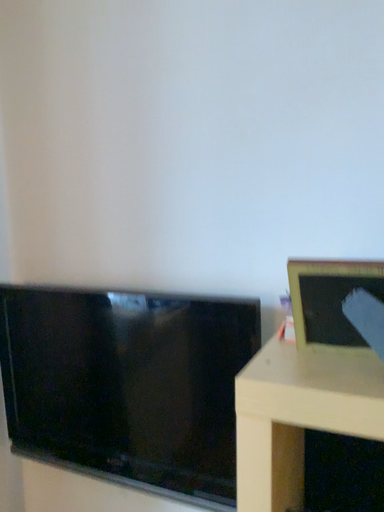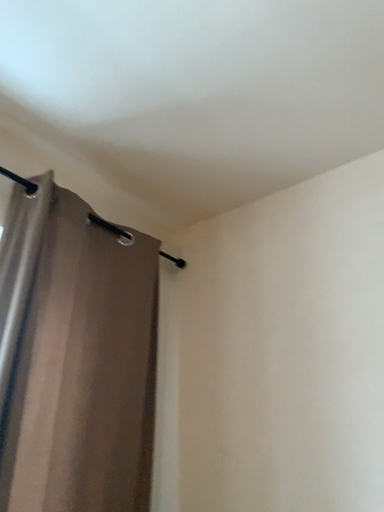
Question: How did the camera likely rotate when shooting the video?

Choices:
 (A) rotated downward
 (B) rotated upward

Answer: (B)